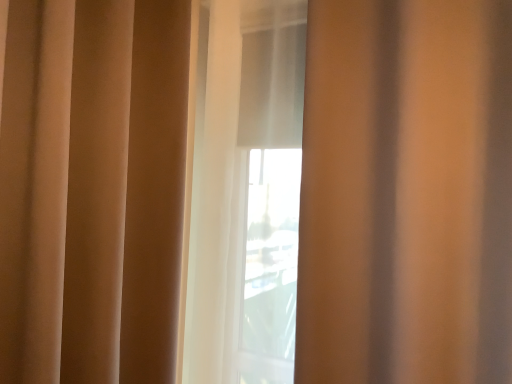
Question: Should I look upward or downward to see matte beige curtain at center?

Choices:
 (A) up
 (B) down

Answer: (A)